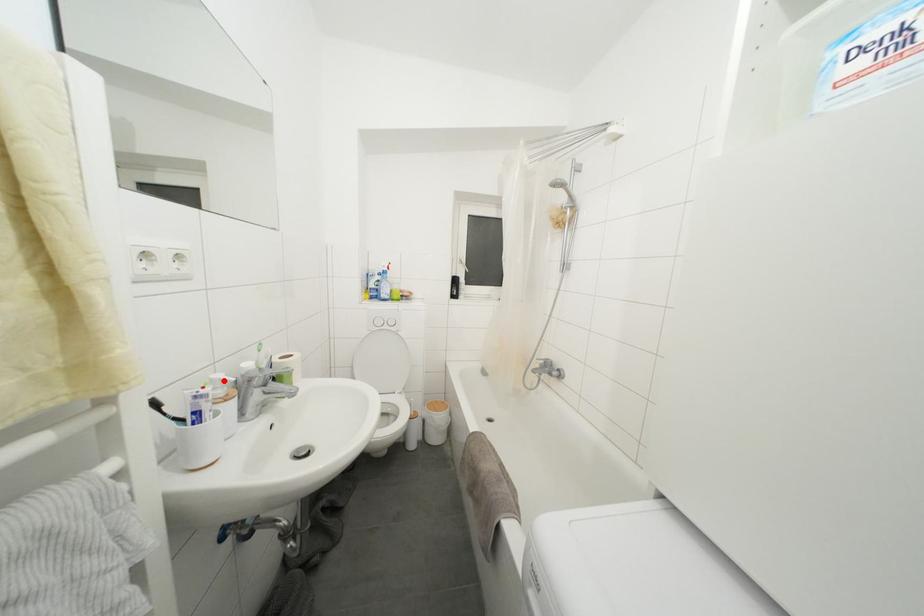
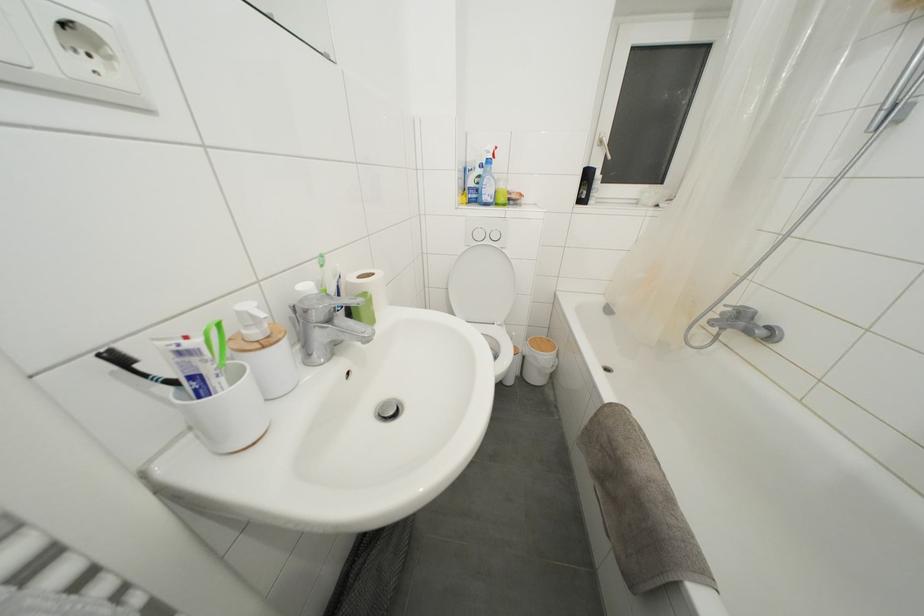
Locate, in the second image, the point that corresponds to the highlighted location in the first image.

(253, 310)